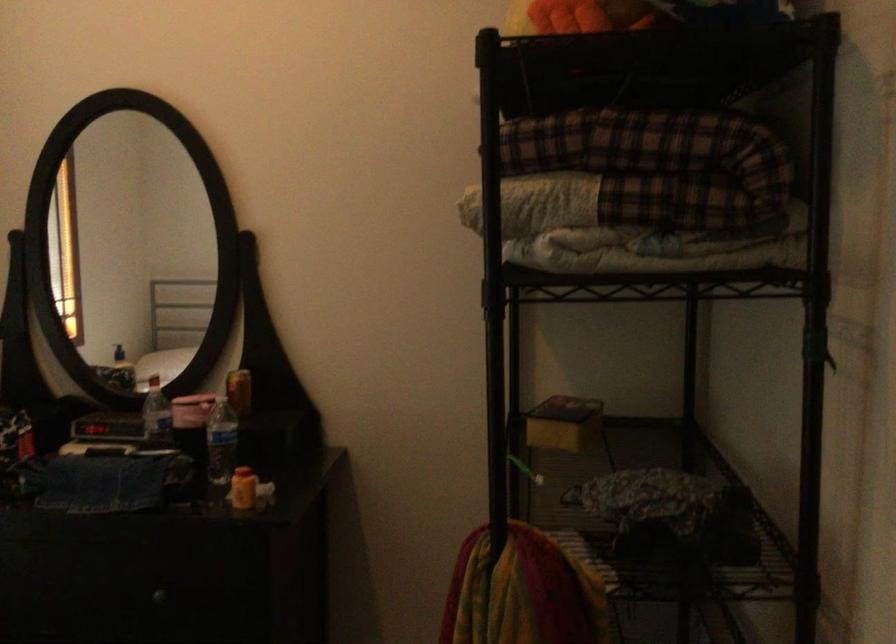
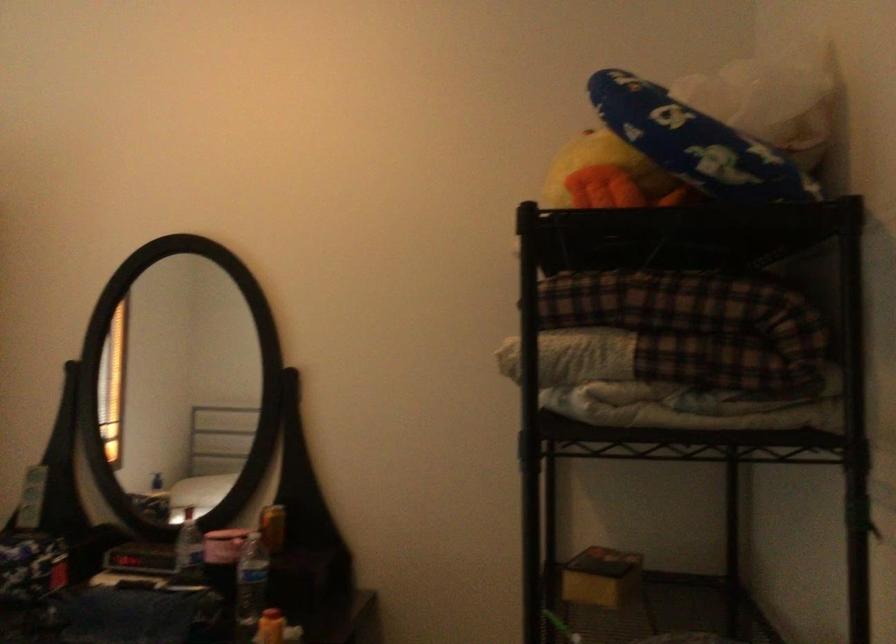
Where in the second image is the point corresponding to point (243, 482) from the first image?

(270, 627)